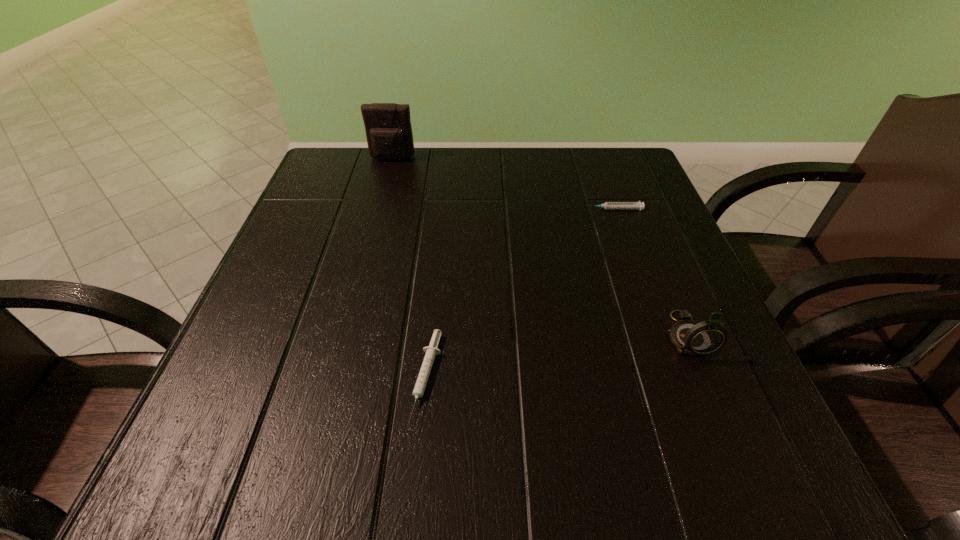
Where is `free region at the near edge`? free region at the near edge is located at coordinates (565, 461).

The width and height of the screenshot is (960, 540). In the image, there is a desktop. What are the coordinates of `vacant space at the left edge` in the screenshot? It's located at (300, 347).

What are the coordinates of `vacant space at the right edge of the desktop` in the screenshot? It's located at (669, 312).

This screenshot has height=540, width=960. I want to click on free space at the near left corner of the desktop, so click(286, 451).

Find the location of `free space between the left syringe and the pouch`. free space between the left syringe and the pouch is located at coordinates (410, 268).

You are a GUI agent. You are given a task and a screenshot of the screen. Output one action in this format:
    pyautogui.click(x=<x>, y=<y>)
    Task: Click on the vacant area that lies between the compass and the second object from left to right
    This screenshot has width=960, height=540.
    Given the screenshot: What is the action you would take?
    [557, 356]

I want to click on free space that is in between the right syringe and the compass, so click(x=650, y=272).

Where is `blank region between the third shortest object and the tallest object`? This screenshot has width=960, height=540. blank region between the third shortest object and the tallest object is located at coordinates (540, 247).

Identify the location of vacant space that's between the second farthest object and the nearer syringe. (520, 293).

Identify the location of free space between the second object from left to right and the second farthest object. Image resolution: width=960 pixels, height=540 pixels. (520, 293).